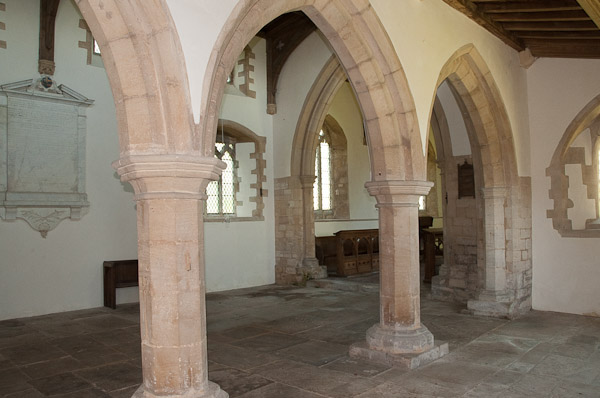
The height and width of the screenshot is (398, 600). Identify the location of pillars. (409, 284), (195, 311).